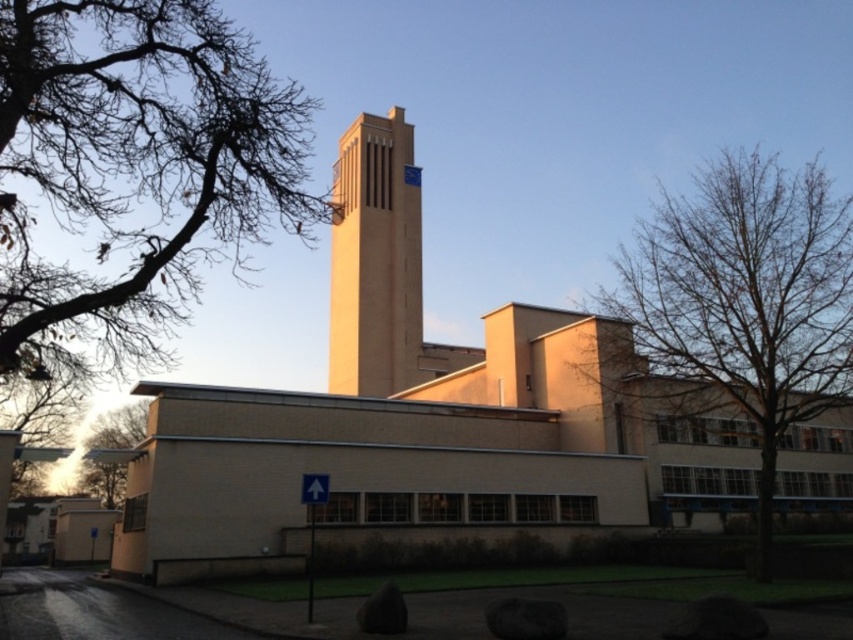
Can you confirm if bare wood tree at center is positioned above green leafy tree at lower left?

Indeed, bare wood tree at center is positioned over green leafy tree at lower left.

The image size is (853, 640). Describe the element at coordinates (747, 296) in the screenshot. I see `bare wood tree at center` at that location.

Identify the location of bare wood tree at center. The height and width of the screenshot is (640, 853). (747, 296).

Find the location of a particular element. bare wood tree at center is located at coordinates (747, 296).

Who is more forward, (x=612, y=358) or (x=100, y=428)?

Positioned in front is point (x=612, y=358).

I want to click on beige concrete church at center, so [425, 417].

Between point (398, 289) and point (392, 113), which one is positioned behind?

The point (392, 113) is more distant.

Is beige concrete church at center to the right of beige brick tower at center from the viewer's perspective?

Indeed, beige concrete church at center is positioned on the right side of beige brick tower at center.

Locate an element on the screen. The width and height of the screenshot is (853, 640). beige concrete church at center is located at coordinates (425, 417).

Identify the location of beige concrete church at center. This screenshot has width=853, height=640. (425, 417).